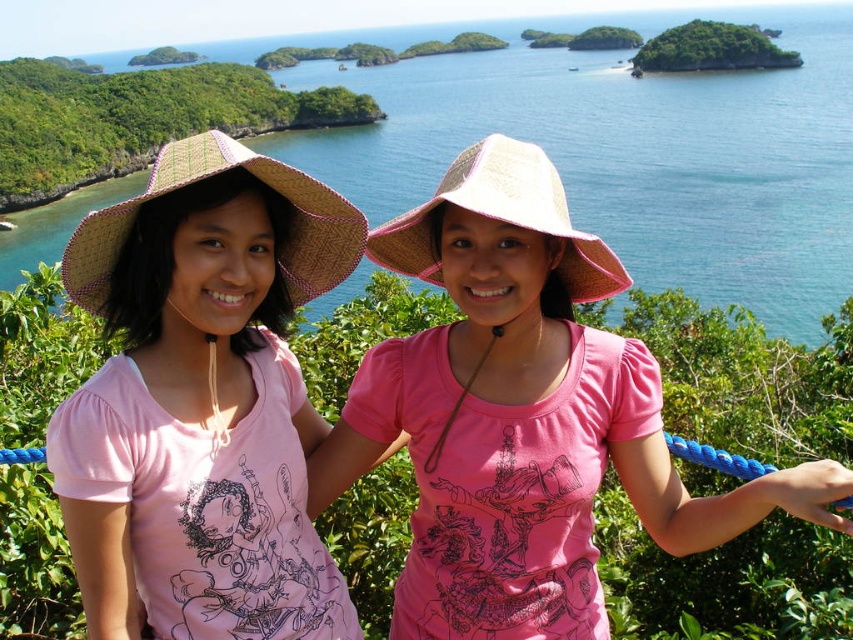
Can you confirm if pink woven hat at center is positioned below matte straw hat at center?

Incorrect, pink woven hat at center is not positioned below matte straw hat at center.

The image size is (853, 640). Find the location of `pink woven hat at center`. pink woven hat at center is located at coordinates (523, 417).

Who is more forward, (558,444) or (160,163)?

Positioned in front is point (160,163).

The width and height of the screenshot is (853, 640). I want to click on pink woven hat at center, so [x=523, y=417].

From the picture: Is matte straw hat at center thinner than straw hat at center?

Yes, matte straw hat at center is thinner than straw hat at center.

Locate an element on the screen. This screenshot has width=853, height=640. matte straw hat at center is located at coordinates (202, 401).

Between strawtexturehat at left and straw hat at center, which one has more height?

With more height is straw hat at center.

This screenshot has width=853, height=640. What are the coordinates of `strawtexturehat at left` in the screenshot? It's located at tap(224, 177).